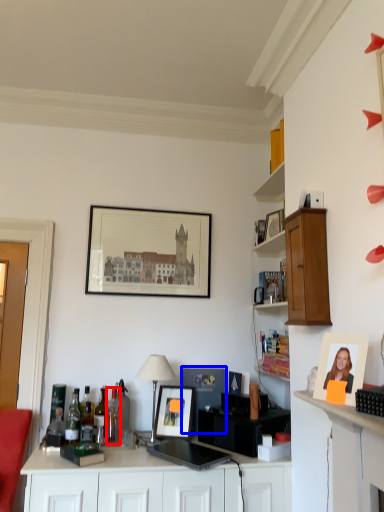
Question: Which of the following is the closest to the observer, bottle (highlighted by a red box) or picture frame (highlighted by a blue box)?

Choices:
 (A) bottle
 (B) picture frame

Answer: (A)